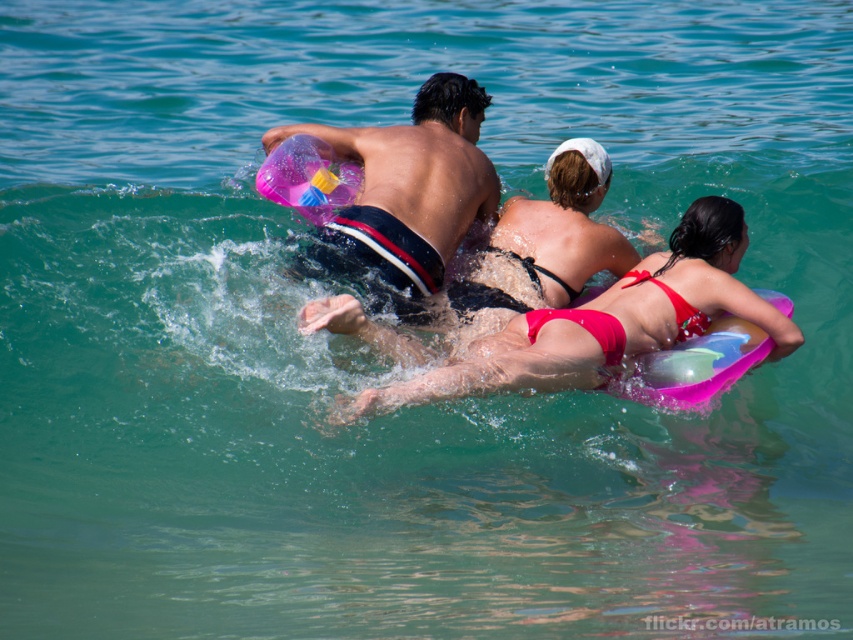
You are a photographer at the beach trying to capture a photo of the pink rubber ball at center and the matte black bikini at center. Which object should you focus on if you want to capture the one that appears taller in the frame?

The pink rubber ball at center appears taller than the matte black bikini at center, so you should focus on the pink rubber ball at center to capture the taller object.